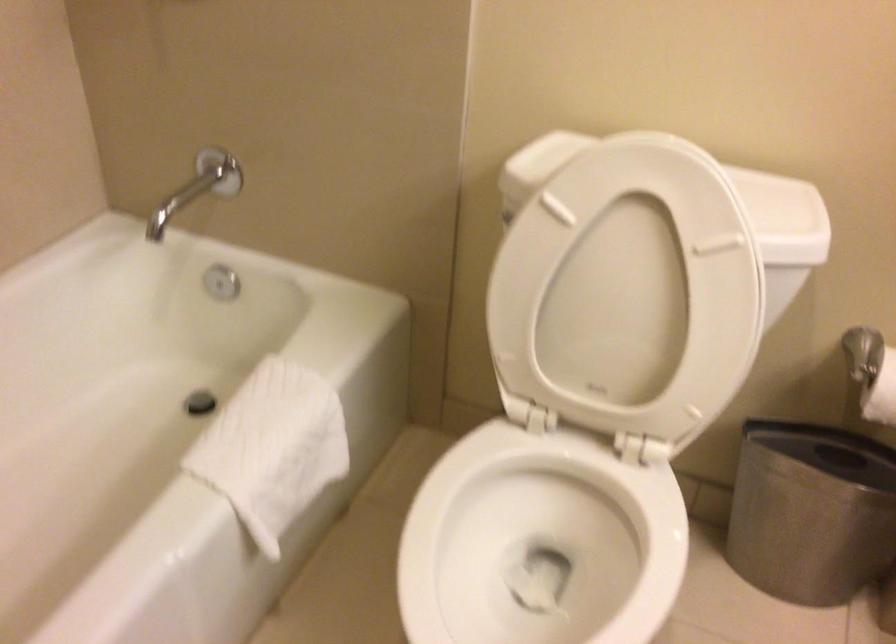
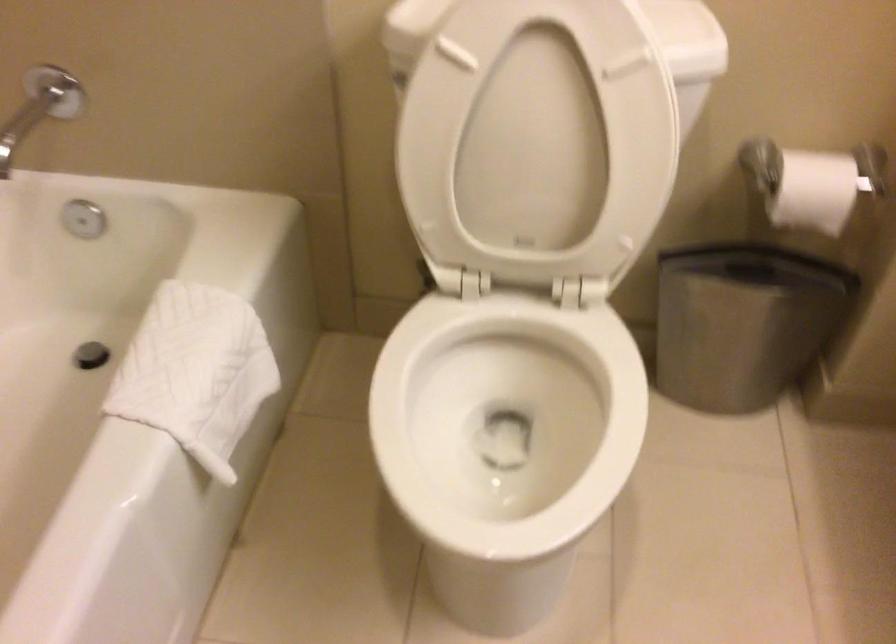
Where in the second image is the point corresponding to point (269, 449) from the first image?

(195, 372)